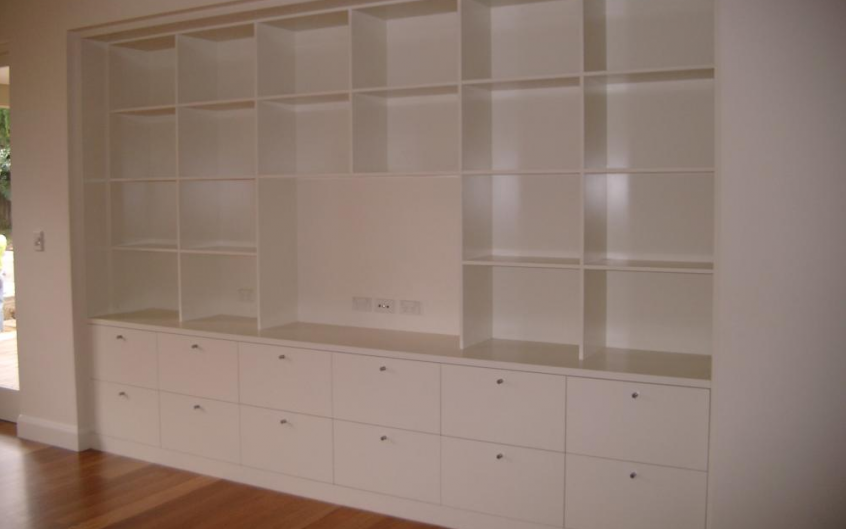
Image resolution: width=846 pixels, height=529 pixels. I want to click on hardwood floor, so click(x=119, y=509).